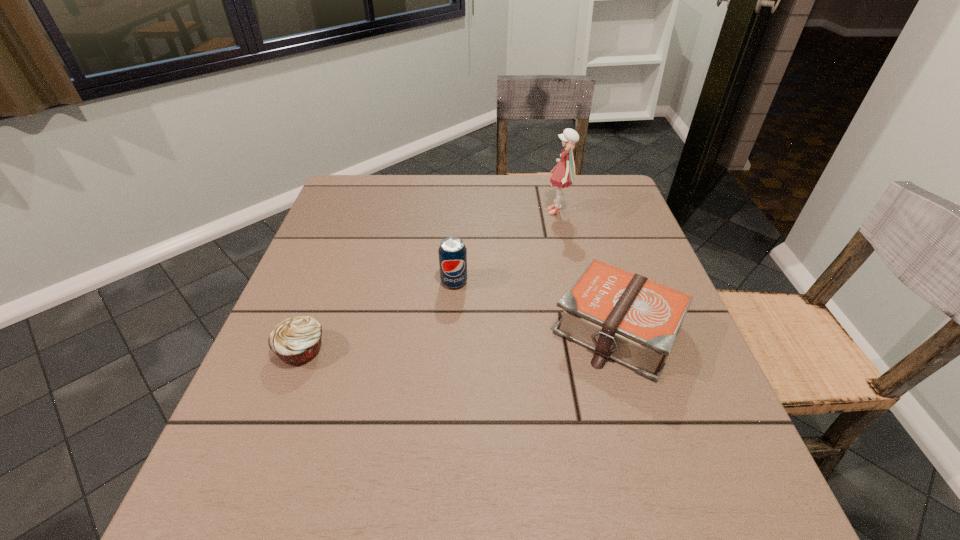
Locate an element on the screen. This screenshot has width=960, height=540. vacant space at the far left corner of the desktop is located at coordinates (362, 197).

Locate an element on the screen. free space at the near left corner of the desktop is located at coordinates (228, 516).

In order to click on free space at the far right corner of the desktop in this screenshot , I will do `click(579, 198)`.

Identify the location of vacant space at the near right corner of the desktop. This screenshot has width=960, height=540. (720, 486).

Locate an element on the screen. vacant area that lies between the leftmost object and the second shortest object is located at coordinates (460, 340).

Image resolution: width=960 pixels, height=540 pixels. I want to click on empty space that is in between the third object from right to left and the doll, so click(506, 247).

The height and width of the screenshot is (540, 960). Identify the location of free space between the doll and the muffin. (430, 281).

Where is `empty space that is in between the third tallest object and the third shortest object`? This screenshot has width=960, height=540. empty space that is in between the third tallest object and the third shortest object is located at coordinates (536, 305).

Locate an element on the screen. free spot between the doll and the soda can is located at coordinates (506, 247).

You are a GUI agent. You are given a task and a screenshot of the screen. Output one action in this format:
    pyautogui.click(x=<x>, y=<y>)
    Task: Click on the vacant area that lies between the third tallest object and the soda can
    The height and width of the screenshot is (540, 960).
    Given the screenshot: What is the action you would take?
    pyautogui.click(x=536, y=305)